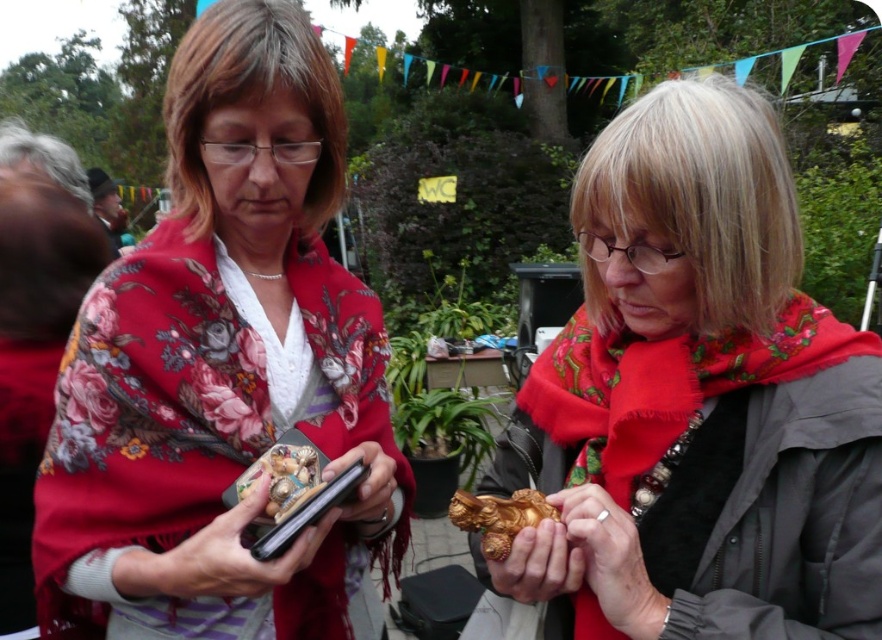
Question: Which object appears closest to the camera in this image?

Choices:
 (A) gold metallic ornament at center
 (B) gold metallic statue at center
 (C) matte black phone at center

Answer: (B)

Question: Does gold textured ornament at center appear under gold metallic ornament at center?

Choices:
 (A) yes
 (B) no

Answer: (B)

Question: Among these objects, which one is farthest from the camera?

Choices:
 (A) floral scarf at center
 (B) matte black phone at center

Answer: (B)

Question: Estimate the real-world distances between objects in this image. Which object is farther from the floral scarf at center?

Choices:
 (A) gold textured ornament at center
 (B) gold metallic statue at center
 (C) gold metallic ornament at center

Answer: (C)

Question: Can you confirm if floral scarf at center is positioned above gold textured ornament at center?

Choices:
 (A) yes
 (B) no

Answer: (A)

Question: Observing the image, what is the correct spatial positioning of gold metallic ornament at center in reference to matte black phone at center?

Choices:
 (A) right
 (B) left

Answer: (A)